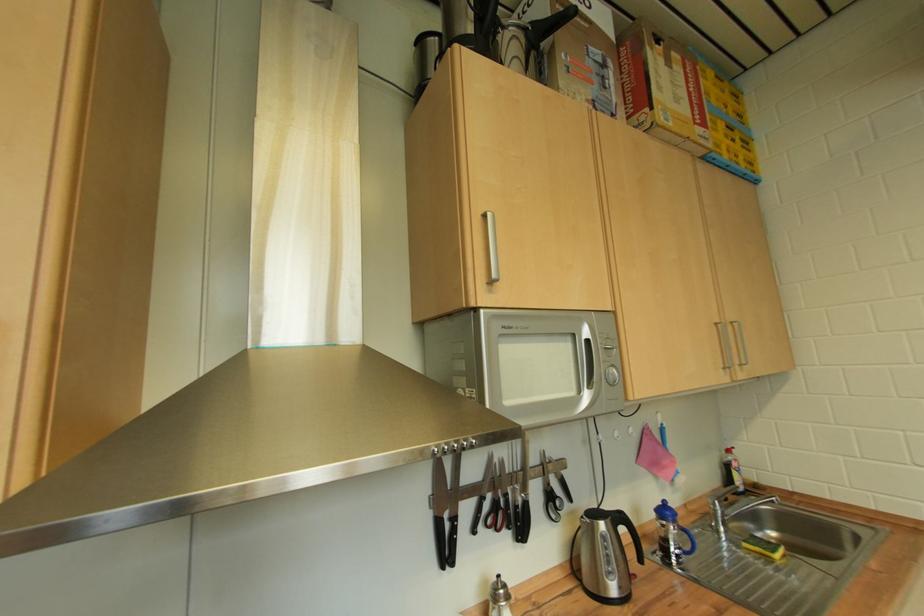
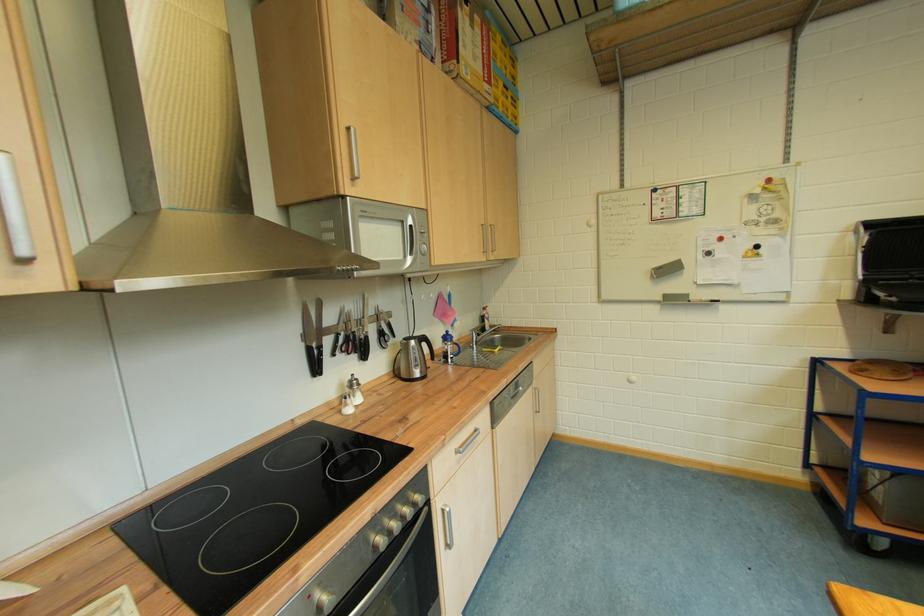
Find the pixel in the second image that matches the point at 445,525 in the first image.

(317, 352)